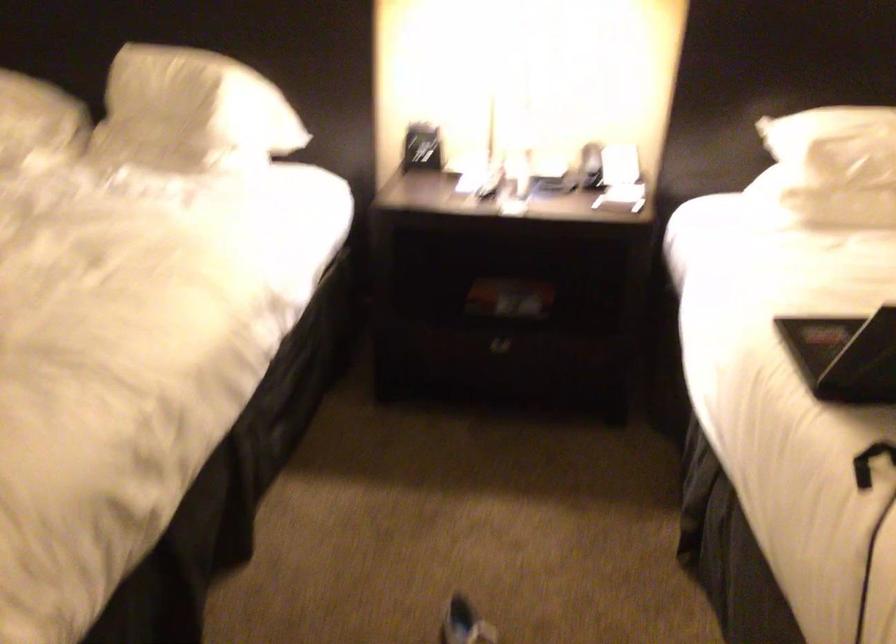
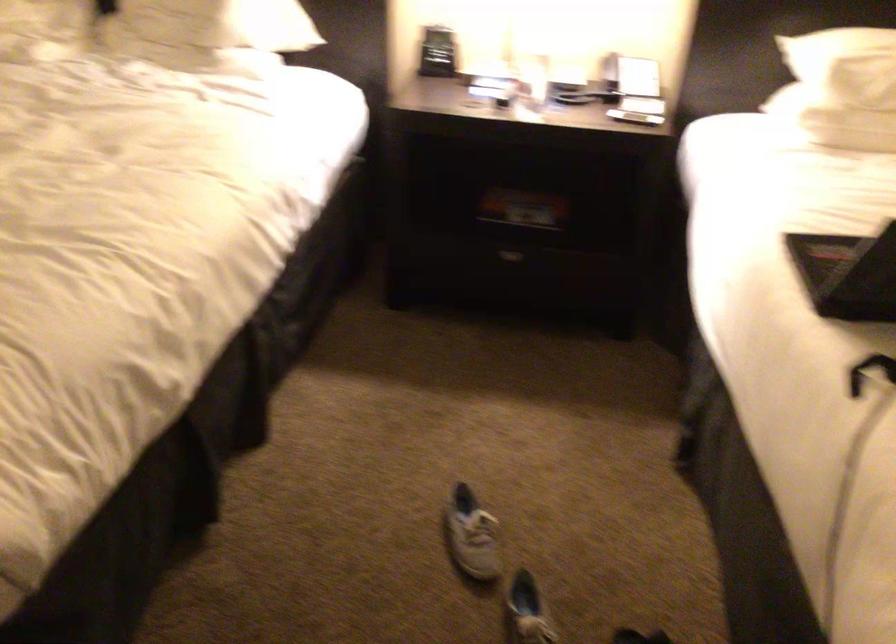
Question: The first image is from the beginning of the video and the second image is from the end. How did the camera likely rotate when shooting the video?

Choices:
 (A) Left
 (B) Right
 (C) Up
 (D) Down

Answer: (D)